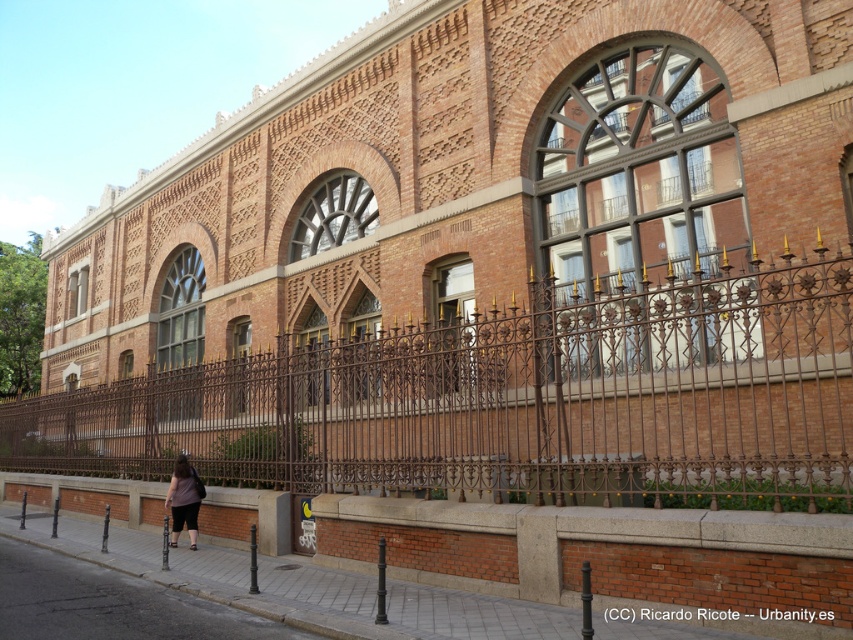
Question: Which object is closer to the camera taking this photo?

Choices:
 (A) gray concrete pavement at lower center
 (B) brown wrought iron fence at center
 (C) dark brown fabric pants at lower left
 (D) gray concrete sidewalk at lower left

Answer: (B)

Question: Which object is positioned closest to the gray concrete sidewalk at lower left?

Choices:
 (A) dark brown fabric pants at lower left
 (B) gray concrete pavement at lower center

Answer: (B)

Question: In this image, where is brown wrought iron fence at center located relative to gray concrete pavement at lower center?

Choices:
 (A) above
 (B) below

Answer: (A)

Question: Does gray concrete pavement at lower center appear under gray concrete sidewalk at lower left?

Choices:
 (A) yes
 (B) no

Answer: (A)

Question: Is gray concrete sidewalk at lower left further to the viewer compared to dark brown fabric pants at lower left?

Choices:
 (A) yes
 (B) no

Answer: (B)

Question: Which of the following is the farthest from the observer?

Choices:
 (A) brown wrought iron fence at center
 (B) gray concrete sidewalk at lower left
 (C) gray concrete pavement at lower center
 (D) dark brown fabric pants at lower left

Answer: (D)